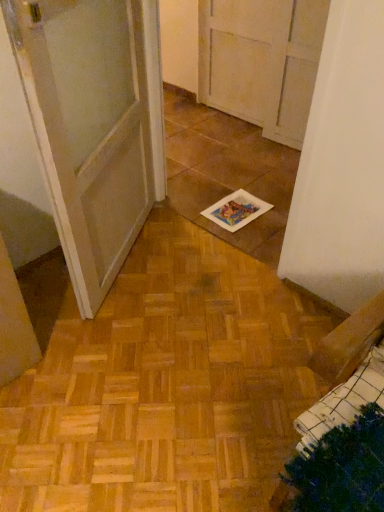
Find the location of `free location in front of white paper at center`. free location in front of white paper at center is located at coordinates (254, 237).